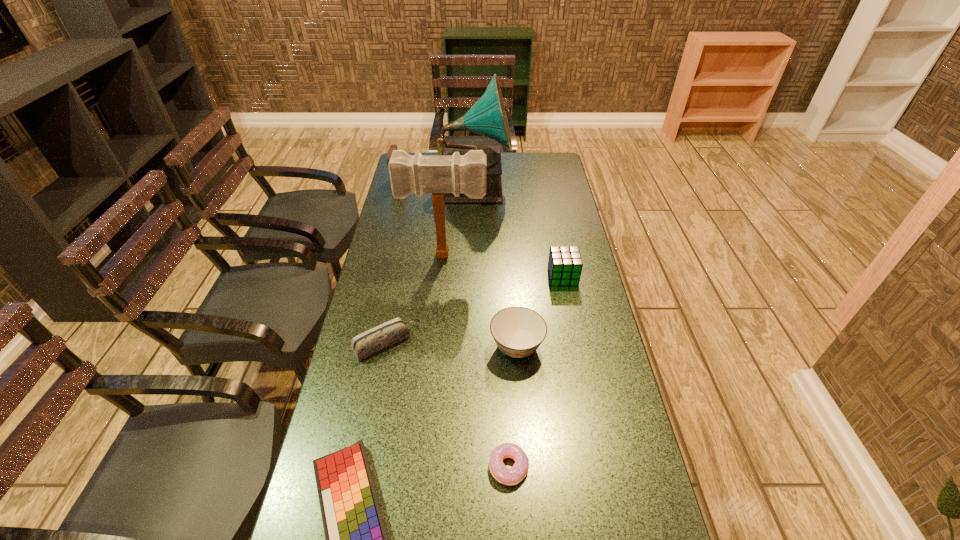
Where is `pencil box that is at the left edge`? This screenshot has width=960, height=540. pencil box that is at the left edge is located at coordinates (382, 336).

Where is `object situated at the right edge`? This screenshot has height=540, width=960. object situated at the right edge is located at coordinates (565, 264).

Where is `object that is positioned at the far left corner`? The height and width of the screenshot is (540, 960). object that is positioned at the far left corner is located at coordinates (393, 147).

Find the location of a particular element. The width and height of the screenshot is (960, 540). free space at the left edge of the desktop is located at coordinates (378, 239).

The height and width of the screenshot is (540, 960). In order to click on free space at the right edge of the desktop in this screenshot , I will do `click(588, 261)`.

Identify the location of free location at the far right corner of the desktop. (551, 178).

Where is `unoccupied area between the doughnut and the pencil box`? unoccupied area between the doughnut and the pencil box is located at coordinates [x=447, y=405].

Where is `empty location between the doughnut and the third shortest object`? This screenshot has width=960, height=540. empty location between the doughnut and the third shortest object is located at coordinates (447, 405).

The image size is (960, 540). In order to click on free space between the sixth shortest object and the second tallest object in this screenshot , I will do `click(421, 220)`.

Find the location of a particular element. free space between the sixth tallest object and the sixth nearest object is located at coordinates 416,299.